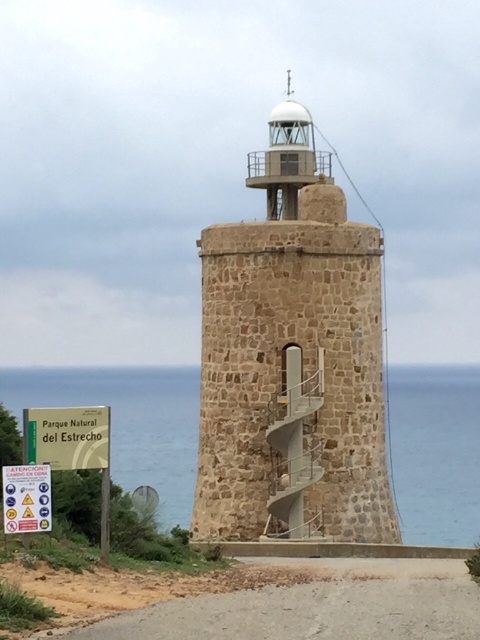
You are a visitor at the coastal area and want to take a photo of the brown stone tower at center and the yellow paper sign at lower left. Which object should you focus on first if you want to include both in your photo without moving the camera?

The brown stone tower at center is much taller than the yellow paper sign at lower left, so you should focus on the brown stone tower at center first to ensure it fits entirely within the frame.

You are a hiker who wants to walk along the brown gravel road at lower center and the satin silver staircase at center. Which path is wider?

The brown gravel road at lower center is wider than the satin silver staircase at center because its width surpasses the staircase.